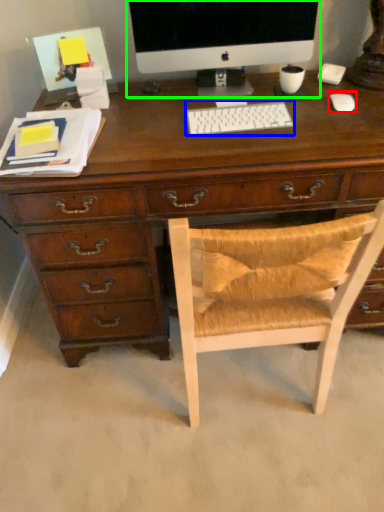
Question: Based on their relative distances, which object is farther from mouse (highlighted by a red box)? Choose from computer keyboard (highlighted by a blue box) and computer monitor (highlighted by a green box).

Choices:
 (A) computer keyboard
 (B) computer monitor

Answer: (B)